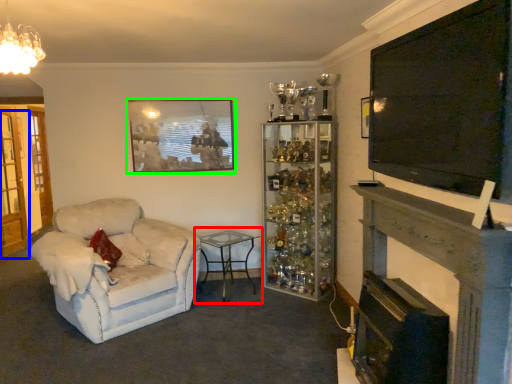
Question: Which object is the farthest from table (highlighted by a red box)? Choose among these: glass door (highlighted by a blue box) or picture frame (highlighted by a green box).

Choices:
 (A) glass door
 (B) picture frame

Answer: (A)